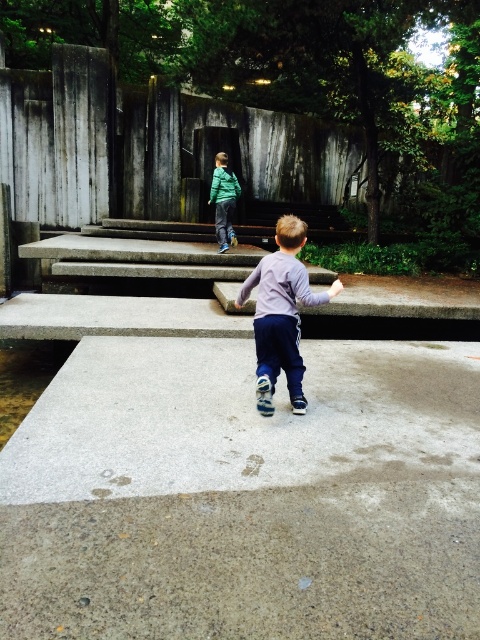
Based on the photo, can you confirm if brown gravel at lower left is smaller than green matte jacket at upper center?

Incorrect, brown gravel at lower left is not smaller in size than green matte jacket at upper center.

Is brown gravel at lower left thinner than green matte jacket at upper center?

No.

Is point (25, 360) closer to viewer compared to point (224, 241)?

Yes, it is in front of point (224, 241).

Locate an element on the screen. brown gravel at lower left is located at coordinates (25, 376).

Is gray polished concrete at center thinner than green matte jacket at upper center?

No, gray polished concrete at center is not thinner than green matte jacket at upper center.

Is gray polished concrete at center above green matte jacket at upper center?

Actually, gray polished concrete at center is below green matte jacket at upper center.

Identify the location of gray polished concrete at center. (245, 496).

Is purple cotton pants at center positioned before brown gravel at lower left?

Yes, purple cotton pants at center is closer to the viewer.

Between purple cotton pants at center and brown gravel at lower left, which one has more height?

Standing taller between the two is purple cotton pants at center.

The height and width of the screenshot is (640, 480). I want to click on purple cotton pants at center, so click(282, 314).

Identify the location of purple cotton pants at center. (282, 314).